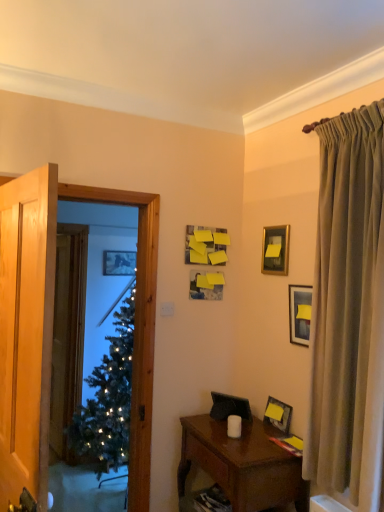
Find the location of `vacant position to the left of white matte candle at center`. vacant position to the left of white matte candle at center is located at coordinates (209, 433).